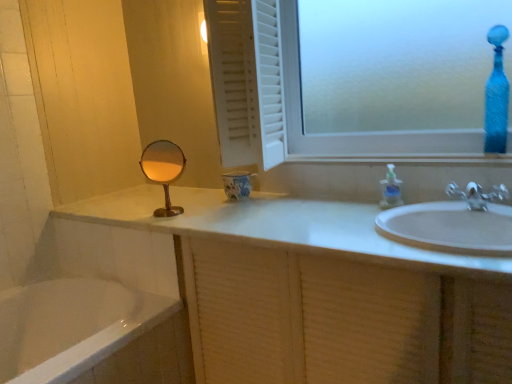
Question: Considering the relative sizes of blue textured glass vase at upper right and frosted glass window at upper center in the image provided, is blue textured glass vase at upper right thinner than frosted glass window at upper center?

Choices:
 (A) no
 (B) yes

Answer: (B)

Question: Would you say blue textured glass vase at upper right contains frosted glass window at upper center?

Choices:
 (A) no
 (B) yes

Answer: (A)

Question: From the image's perspective, is blue textured glass vase at upper right beneath frosted glass window at upper center?

Choices:
 (A) no
 (B) yes

Answer: (B)

Question: From the image's perspective, does blue textured glass vase at upper right appear higher than frosted glass window at upper center?

Choices:
 (A) yes
 (B) no

Answer: (B)

Question: Is blue textured glass vase at upper right far from frosted glass window at upper center?

Choices:
 (A) no
 (B) yes

Answer: (A)

Question: Considering the relative positions of blue textured glass vase at upper right and frosted glass window at upper center in the image provided, is blue textured glass vase at upper right in front of frosted glass window at upper center?

Choices:
 (A) no
 (B) yes

Answer: (A)

Question: From the image's perspective, is blue textured glass vase at upper right below white textured cabinet at lower right?

Choices:
 (A) yes
 (B) no

Answer: (B)

Question: From the image's perspective, would you say blue textured glass vase at upper right is positioned over white textured cabinet at lower right?

Choices:
 (A) no
 (B) yes

Answer: (B)

Question: Does blue textured glass vase at upper right appear on the left side of white textured cabinet at lower right?

Choices:
 (A) yes
 (B) no

Answer: (B)

Question: Does blue textured glass vase at upper right lie in front of white textured cabinet at lower right?

Choices:
 (A) yes
 (B) no

Answer: (B)

Question: Considering the relative sizes of blue textured glass vase at upper right and white textured cabinet at lower right in the image provided, is blue textured glass vase at upper right wider than white textured cabinet at lower right?

Choices:
 (A) yes
 (B) no

Answer: (B)

Question: Is blue textured glass vase at upper right positioned behind white textured cabinet at lower right?

Choices:
 (A) no
 (B) yes

Answer: (B)

Question: Considering the relative sizes of blue textured glass vase at upper right and silver metallic faucet at right in the image provided, is blue textured glass vase at upper right taller than silver metallic faucet at right?

Choices:
 (A) no
 (B) yes

Answer: (B)